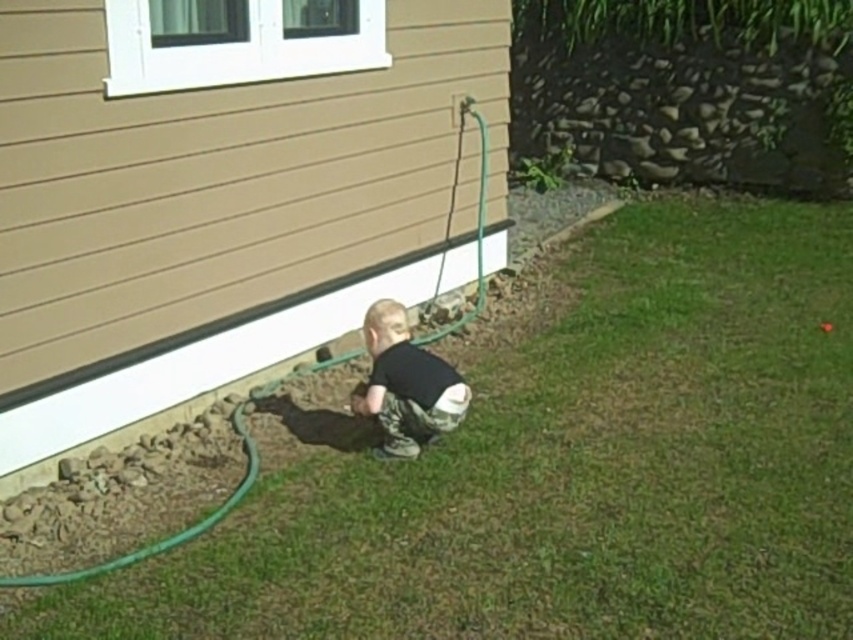
Question: Estimate the real-world distances between objects in this image. Which object is farther from the green grass at lower center?

Choices:
 (A) green rubber hose at lower left
 (B) black matte shirt at center

Answer: (A)

Question: Among these objects, which one is farthest from the camera?

Choices:
 (A) green rubber hose at lower left
 (B) black matte shirt at center

Answer: (A)

Question: Which of the following is the closest to the observer?

Choices:
 (A) green grass at lower center
 (B) black matte shirt at center

Answer: (A)

Question: Is green grass at lower center below black matte shirt at center?

Choices:
 (A) no
 (B) yes

Answer: (B)

Question: Is green grass at lower center positioned in front of black matte shirt at center?

Choices:
 (A) no
 (B) yes

Answer: (B)

Question: Can you confirm if green grass at lower center is positioned to the left of green rubber hose at lower left?

Choices:
 (A) no
 (B) yes

Answer: (A)